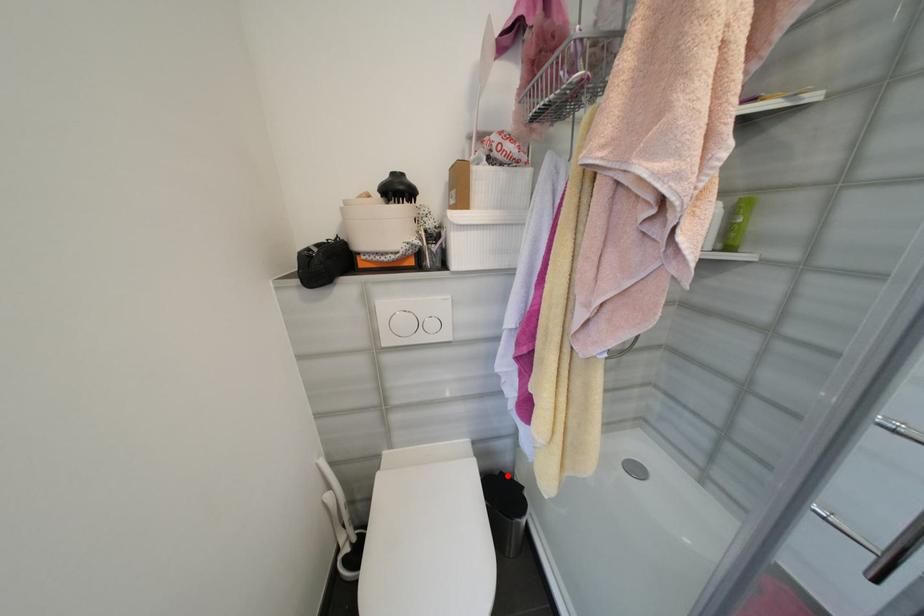
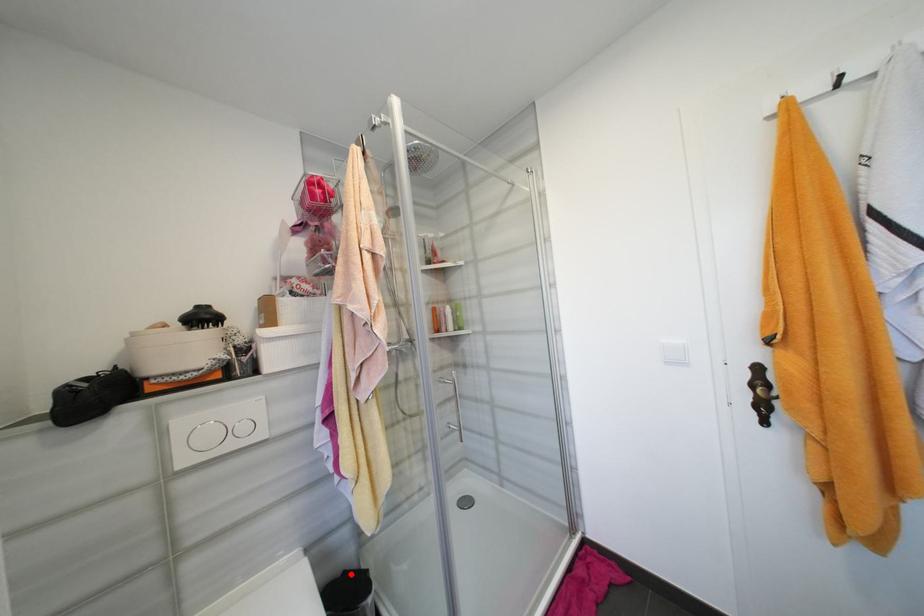
I am providing you with two images of the same scene from different viewpoints. A red point is marked on the first image and another point is marked on the second image. Are the points marked in image1 and image2 representing the same 3D position?

Yes